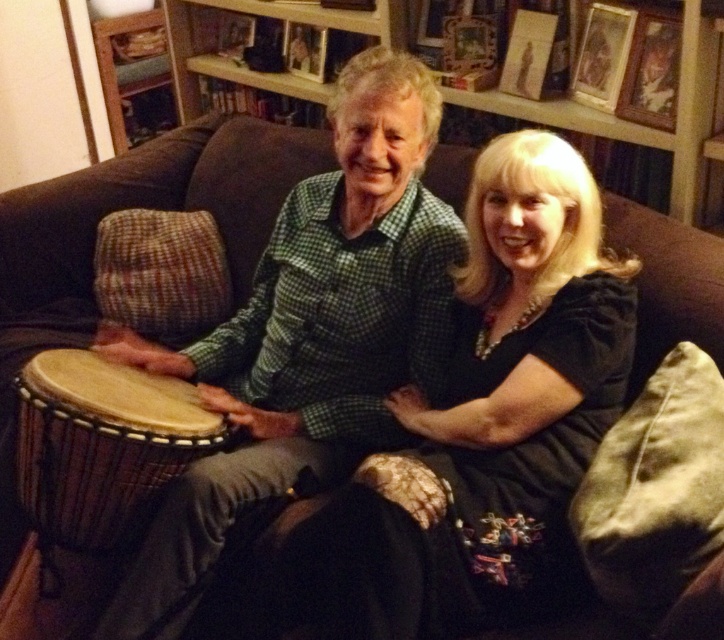
Question: Which object is farther from the camera taking this photo?

Choices:
 (A) natural wood drum at center
 (B) wooden picture frame at upper right

Answer: (B)

Question: Which of the following is the farthest from the observer?

Choices:
 (A) (675, 65)
 (B) (51, 449)

Answer: (A)

Question: Does natural wood drum at center have a greater width compared to wooden picture frame at upper right?

Choices:
 (A) no
 (B) yes

Answer: (B)

Question: Is natural wood drum at center below wooden picture frame at upper right?

Choices:
 (A) yes
 (B) no

Answer: (A)

Question: Does natural wood drum at center appear under wooden picture frame at upper right?

Choices:
 (A) yes
 (B) no

Answer: (A)